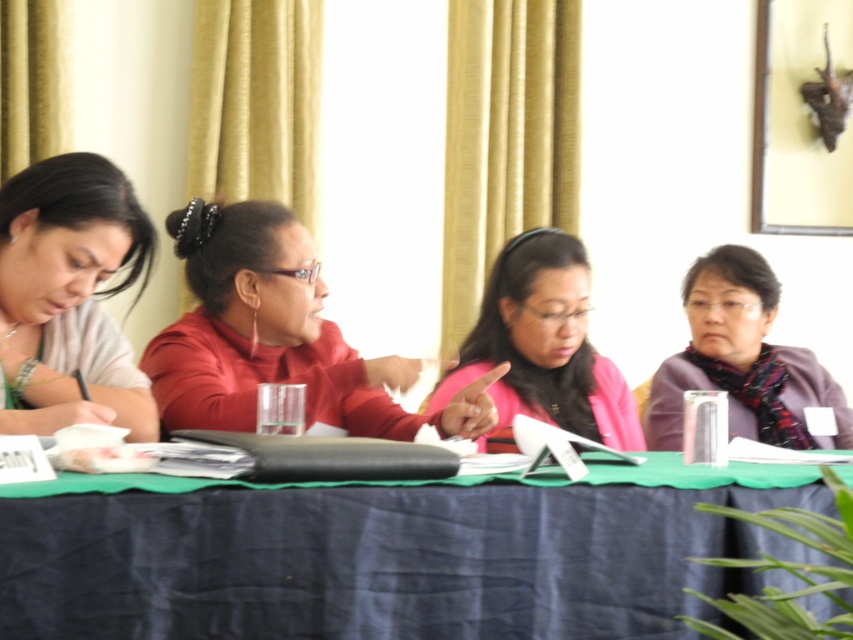
You are organizing a table for a formal event and need to ensure that the blue fabric tablecloth at center and the purple scarf at right are properly arranged. Which item should you place first to accommodate their sizes?

The blue fabric tablecloth at center should be placed first because it is smaller than the purple scarf at right, allowing more space for the larger item afterward.

You are a guest at this meeting and need to place a small notebook between the blue fabric tablecloth at center and the purple scarf at right. Based on their positions, where should you place the notebook to ensure it is between them?

The blue fabric tablecloth at center is positioned on the left side of the purple scarf at right, so you should place the notebook to the right of the blue fabric tablecloth at center and to the left of the purple scarf at right to ensure it is between them.

You are standing at the entrance of the conference room. You need to place a new nameplate exactly at the center of the blue fabric tablecloth at center. According to the coordinates provided, where should you place the nameplate?

The blue fabric tablecloth at center is positioned at coordinates point (x=387, y=554), so you should place the nameplate at those coordinates to center it.